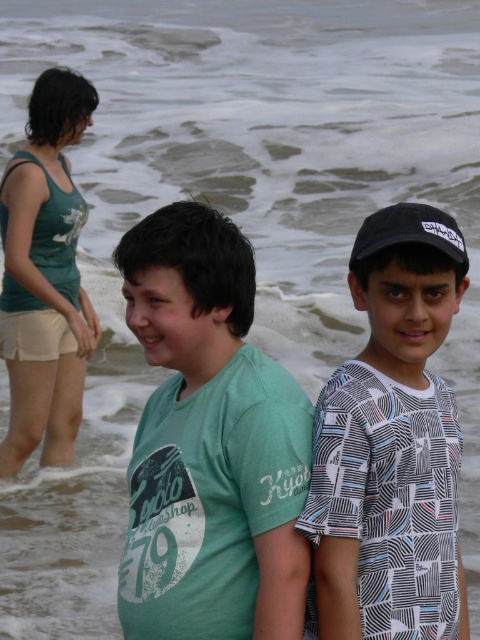
Between printed cotton shirt at center and black matte baseball cap at upper right, which one is positioned higher?

black matte baseball cap at upper right

Locate an element on the screen. The height and width of the screenshot is (640, 480). printed cotton shirt at center is located at coordinates (391, 445).

Identify the location of printed cotton shirt at center. This screenshot has height=640, width=480. (391, 445).

Can you confirm if green matte t-shirt at center is smaller than printed cotton shirt at center?

No, green matte t-shirt at center is not smaller than printed cotton shirt at center.

Consider the image. Can you confirm if green matte t-shirt at center is bigger than printed cotton shirt at center?

Yes.

Between point (267, 600) and point (456, 499), which one is positioned behind?

The point (456, 499) is more distant.

Locate an element on the screen. This screenshot has height=640, width=480. green matte t-shirt at center is located at coordinates (210, 444).

Is green matte t-shirt at center positioned in front of black matte baseball cap at upper right?

No.

Who is lower down, green matte t-shirt at center or black matte baseball cap at upper right?

green matte t-shirt at center is below.

Measure the distance between point (x=296, y=467) and camera.

Point (x=296, y=467) is 4.10 meters from camera.

You are a GUI agent. You are given a task and a screenshot of the screen. Output one action in this format:
    pyautogui.click(x=<x>, y=<y>)
    Task: Click on the green matte t-shirt at center
    This screenshot has width=480, height=640.
    Given the screenshot: What is the action you would take?
    pyautogui.click(x=210, y=444)